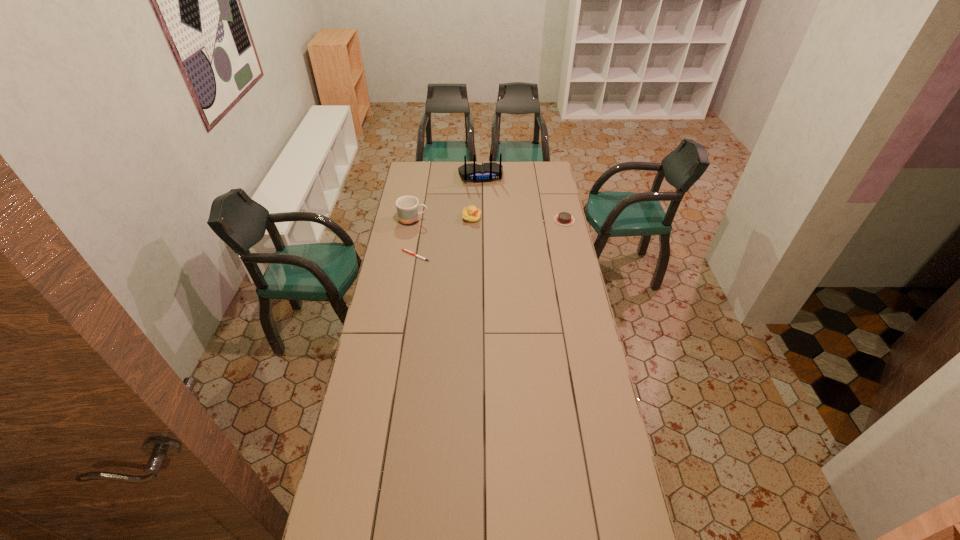
Where is `the shortest object`? Image resolution: width=960 pixels, height=540 pixels. the shortest object is located at coordinates (405, 250).

This screenshot has height=540, width=960. In order to click on pen in this screenshot , I will do `click(405, 250)`.

You are a GUI agent. You are given a task and a screenshot of the screen. Output one action in this format:
    pyautogui.click(x=<x>, y=<y>)
    Task: Click on the rightmost object
    This screenshot has width=960, height=540.
    Given the screenshot: What is the action you would take?
    [x=564, y=218]

Locate an element on the screen. The width and height of the screenshot is (960, 540). chocolate cake is located at coordinates (564, 218).

Image resolution: width=960 pixels, height=540 pixels. In order to click on the third tallest object in this screenshot , I will do `click(471, 214)`.

You are a GUI agent. You are given a task and a screenshot of the screen. Output one action in this format:
    pyautogui.click(x=<x>, y=<y>)
    Task: Click on the mug
    This screenshot has width=960, height=540.
    Given the screenshot: What is the action you would take?
    pyautogui.click(x=407, y=207)

The width and height of the screenshot is (960, 540). Find the location of `the tallest object`. the tallest object is located at coordinates (486, 172).

Find the location of a particular element. The height and width of the screenshot is (540, 960). router is located at coordinates (486, 172).

Find the location of `free space located on the clicker of the pen`. free space located on the clicker of the pen is located at coordinates (389, 256).

Find the location of a particular element. This screenshot has width=960, height=540. vacant space located 0.070m on the clicker of the pen is located at coordinates (387, 256).